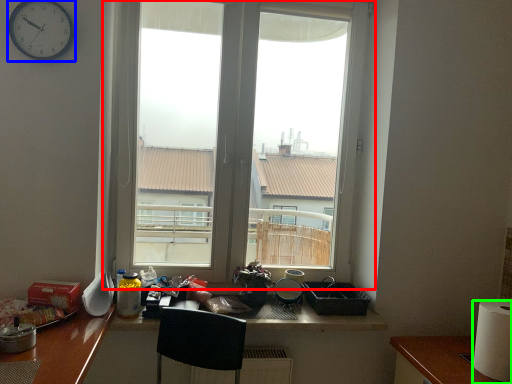
Question: Which object is positioned farthest from window (highlighted by a red box)? Select from clock (highlighted by a blue box) and paper towel (highlighted by a green box).

Choices:
 (A) clock
 (B) paper towel

Answer: (B)